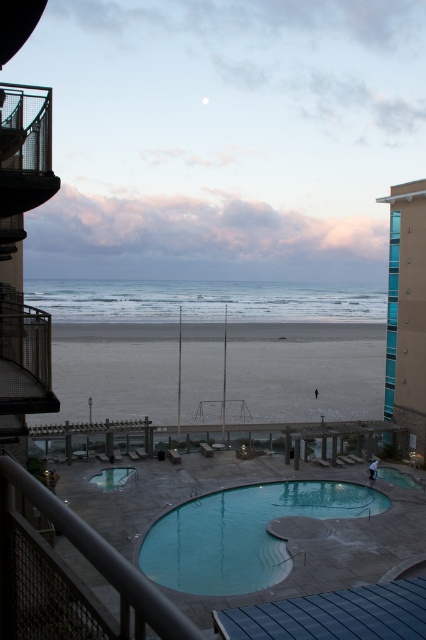
Question: In this image, where is smooth sand beach at center located relative to metallic gray railing at lower center?

Choices:
 (A) right
 (B) left

Answer: (B)

Question: Does teal glass building at right appear over smooth blue pool at center?

Choices:
 (A) no
 (B) yes

Answer: (B)

Question: Considering the real-world distances, which object is farthest from the smooth sand beach at center?

Choices:
 (A) clear glass pool at lower right
 (B) metal mesh balcony at upper left
 (C) blue water at center

Answer: (B)

Question: Does teal glass building at right have a larger size compared to smooth blue pool at center?

Choices:
 (A) yes
 (B) no

Answer: (A)

Question: Which of these objects is positioned closest to the metallic gray railing at lower center?

Choices:
 (A) teal glass building at right
 (B) blue water at center
 (C) metal mesh balcony at upper left
 (D) metallic balcony at left

Answer: (C)

Question: Which of these objects is positioned farthest from the blue water at center?

Choices:
 (A) teal concrete pool at center
 (B) teal glass building at right

Answer: (A)